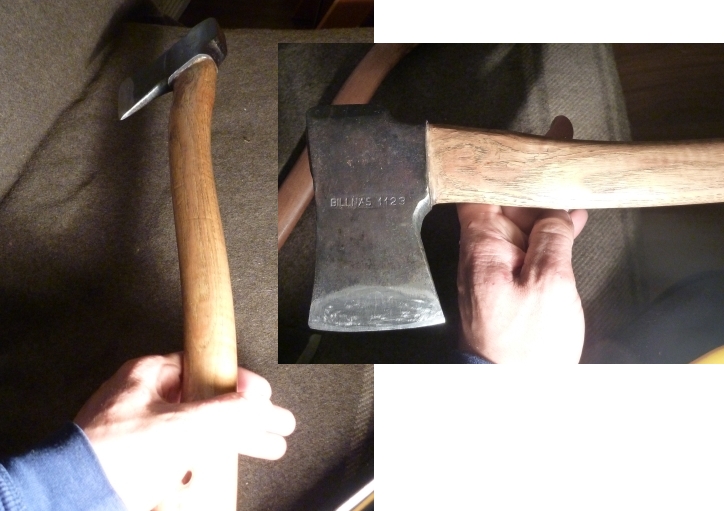
Where is `wood handle`? wood handle is located at coordinates (198, 248).